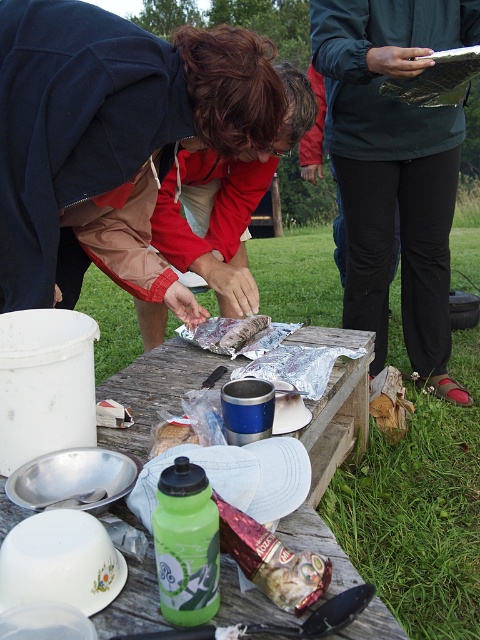
Is the position of brown crumbly bread at center more distant than that of brown paper bag at center?

That is False.

Does brown crumbly bread at center appear on the right side of brown paper bag at center?

No, brown crumbly bread at center is not to the right of brown paper bag at center.

I want to click on brown crumbly bread at center, so click(x=171, y=435).

Locate an element on the screen. matte red jacket at center is located at coordinates (226, 204).

Locate an element on the screen. The width and height of the screenshot is (480, 640). matte red jacket at center is located at coordinates (226, 204).

At what (x,y) coordinates should I click in order to perform the action: click on matte red jacket at center. Please return your answer as a coordinate pair (x, y). Looking at the image, I should click on (226, 204).

Can you confirm if matte red jacket at center is shorter than brown paper bag at center?

No.

Can you confirm if matte red jacket at center is positioned below brown paper bag at center?

Incorrect, matte red jacket at center is not positioned below brown paper bag at center.

Between point (226, 193) and point (244, 323), which one is positioned behind?

Point (226, 193)

Locate an element on the screen. The width and height of the screenshot is (480, 640). matte red jacket at center is located at coordinates (226, 204).